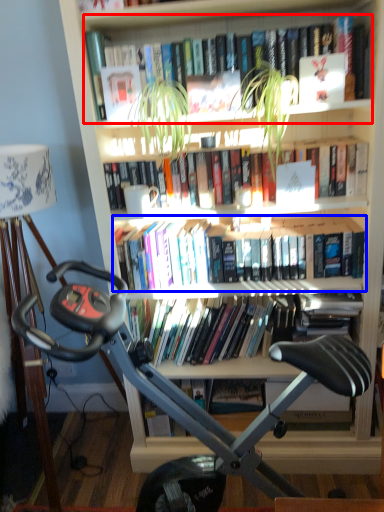
Question: Which of the following is the closest to the observer, book (highlighted by a red box) or book (highlighted by a blue box)?

Choices:
 (A) book
 (B) book

Answer: (A)